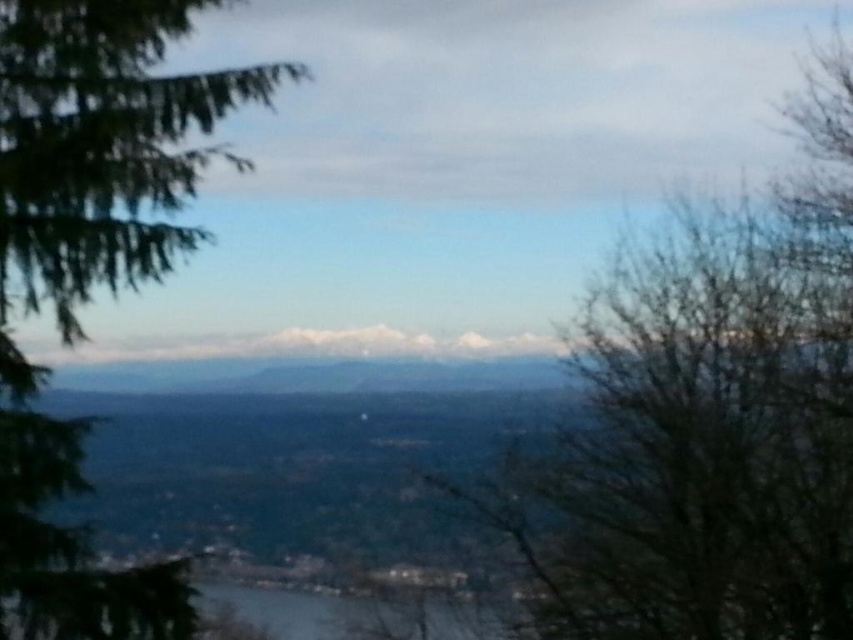
Question: Which of the following is the farthest from the observer?

Choices:
 (A) (102, 109)
 (B) (848, 212)

Answer: (B)

Question: Which of the following is the farthest from the observer?

Choices:
 (A) [x=3, y=13]
 (B) [x=746, y=403]

Answer: (B)

Question: Does bare branches at right appear on the left side of green textured pine tree at left?

Choices:
 (A) no
 (B) yes

Answer: (A)

Question: Is the position of bare branches at right less distant than that of green textured pine tree at left?

Choices:
 (A) no
 (B) yes

Answer: (A)

Question: Can you confirm if bare branches at right is smaller than green textured pine tree at left?

Choices:
 (A) no
 (B) yes

Answer: (B)

Question: Which object is closer to the camera taking this photo?

Choices:
 (A) green textured pine tree at left
 (B) bare branches at right

Answer: (A)